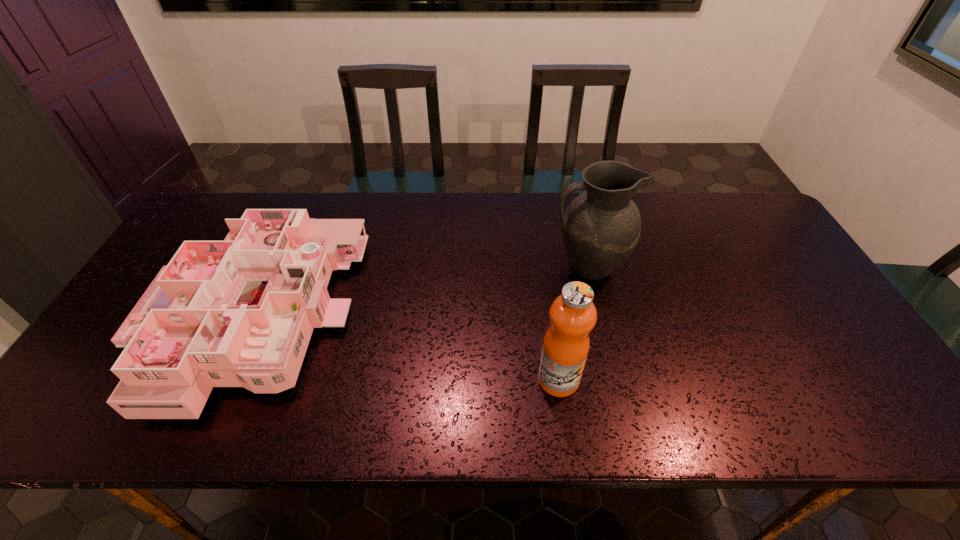
Find the location of `pitcher`. pitcher is located at coordinates (601, 226).

Identify the location of fruit juice. Image resolution: width=960 pixels, height=540 pixels. (573, 315).

This screenshot has height=540, width=960. Find the location of `dollhouse`. dollhouse is located at coordinates (236, 313).

The height and width of the screenshot is (540, 960). In order to click on the shortest object in this screenshot , I will do `click(236, 313)`.

Identify the location of vacant space located 0.100m on the side of the pitcher with the handle. This screenshot has width=960, height=540. (516, 267).

Locate an element on the screen. The width and height of the screenshot is (960, 540). free point located on the side of the pitcher with the handle is located at coordinates (518, 267).

I want to click on vacant space located on the side of the pitcher with the handle, so click(x=436, y=267).

The width and height of the screenshot is (960, 540). What are the coordinates of `vacant space located 0.130m on the back of the fruit juice` in the screenshot? It's located at (550, 319).

In order to click on vacant space located 0.260m at the front entrance of the shortest object in this screenshot , I will do `click(451, 319)`.

The image size is (960, 540). I want to click on fruit juice situated at the near edge, so click(573, 315).